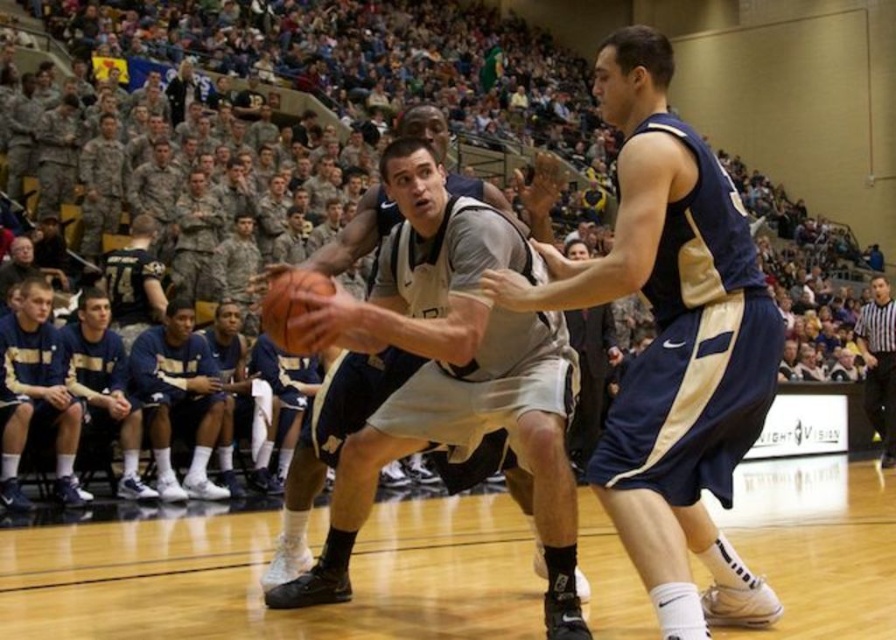
Can you confirm if matte gray jersey at center is positioned to the left of rubber textured basketball at center?

No, matte gray jersey at center is not to the left of rubber textured basketball at center.

Is point (463, 200) positioned before point (304, 346)?

No, (463, 200) is further to viewer.

Image resolution: width=896 pixels, height=640 pixels. Find the location of `matte gray jersey at center`. matte gray jersey at center is located at coordinates (450, 376).

Is black and white striped shirt at right wider than rubber textured basketball at center?

Correct, the width of black and white striped shirt at right exceeds that of rubber textured basketball at center.

Describe the element at coordinates (879, 364) in the screenshot. I see `black and white striped shirt at right` at that location.

Where is `black and white striped shirt at right`? The width and height of the screenshot is (896, 640). black and white striped shirt at right is located at coordinates (879, 364).

Who is higher up, dark blue jersey at lower left or black and white striped shirt at right?

black and white striped shirt at right is higher up.

Does point (186, 330) lie in front of point (892, 410)?

Yes, point (186, 330) is closer to viewer.

Where is `dark blue jersey at lower left`? dark blue jersey at lower left is located at coordinates (178, 400).